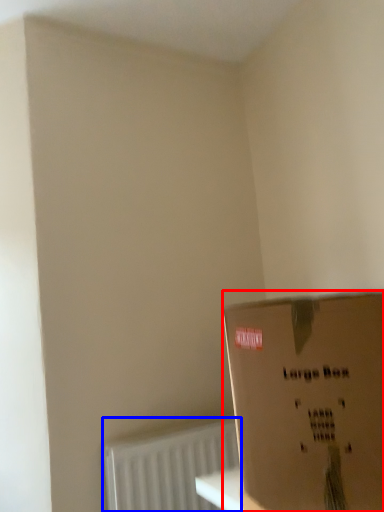
Question: Which object is further to the camera taking this photo, box (highlighted by a red box) or radiator (highlighted by a blue box)?

Choices:
 (A) box
 (B) radiator

Answer: (B)